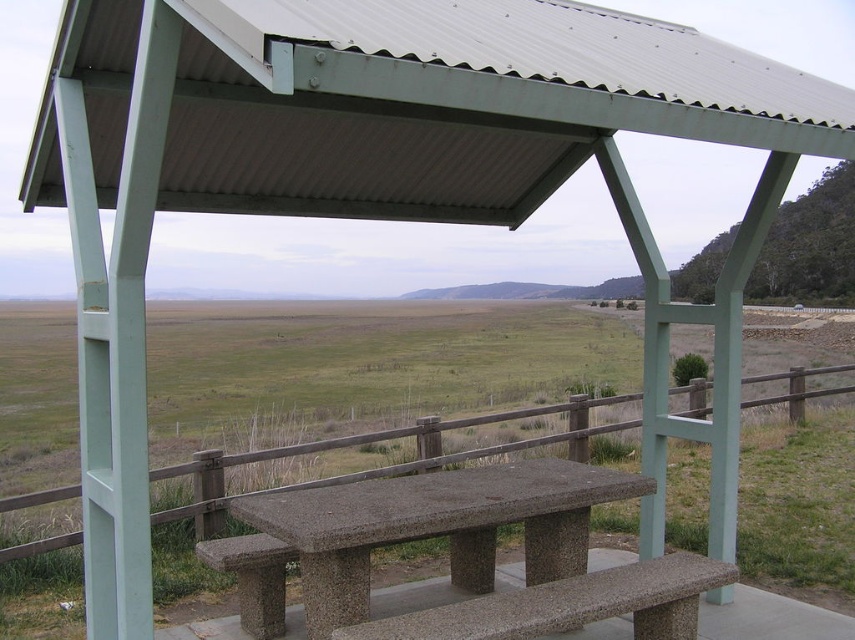
Question: Which point is closer to the camera?

Choices:
 (A) (360, 440)
 (B) (273, 588)
 (C) (482, 477)
 (D) (659, 572)

Answer: (D)

Question: Is concrete bench at center thinner than brown wooden fence at center?

Choices:
 (A) yes
 (B) no

Answer: (A)

Question: Can you confirm if concrete bench at center is thinner than brown wooden fence at center?

Choices:
 (A) no
 (B) yes

Answer: (B)

Question: Estimate the real-world distances between objects in this image. Which object is farther from the granite bench at center?

Choices:
 (A) brown wooden fence at center
 (B) granite bench at lower center

Answer: (A)

Question: Does brown wooden fence at center have a greater width compared to granite bench at lower center?

Choices:
 (A) yes
 (B) no

Answer: (A)

Question: Which point appears closest to the camera in this image?

Choices:
 (A) (706, 582)
 (B) (414, 432)

Answer: (A)